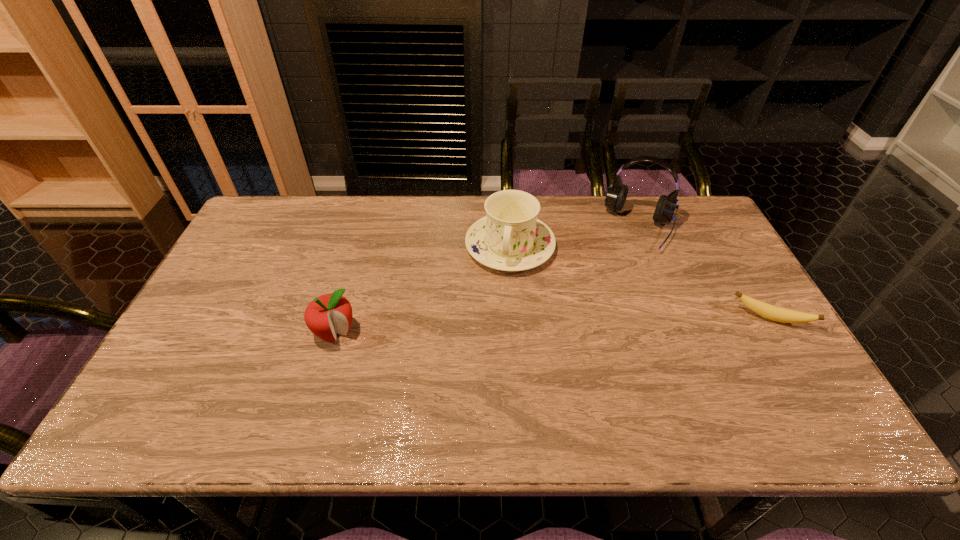
Locate an element on the screen. vacant space at the near edge of the desktop is located at coordinates (725, 390).

The height and width of the screenshot is (540, 960). I want to click on vacant space at the left edge of the desktop, so click(255, 286).

You are a GUI agent. You are given a task and a screenshot of the screen. Output one action in this format:
    pyautogui.click(x=<x>, y=<y>)
    Task: Click on the vacant space at the right edge of the desktop
    The image size is (960, 540).
    Given the screenshot: What is the action you would take?
    pyautogui.click(x=709, y=295)

This screenshot has height=540, width=960. What are the coordinates of `unoccupied position between the third object from right to left and the shortest object` in the screenshot? It's located at (640, 282).

This screenshot has height=540, width=960. Identify the location of empty location between the rightmost object and the chinaware. (640, 282).

You are a GUI agent. You are given a task and a screenshot of the screen. Output one action in this format:
    pyautogui.click(x=<x>, y=<y>)
    Task: Click on the free space between the apple and the third object from left to right
    The height and width of the screenshot is (540, 960).
    Given the screenshot: What is the action you would take?
    pyautogui.click(x=488, y=280)

Identify the location of vacant region between the tallest object and the rightmost object. (706, 273).

Identify the location of vacant area that lies between the leftmost object and the third object from right to left. The height and width of the screenshot is (540, 960). (422, 289).

At what (x,y) coordinates should I click in order to perform the action: click on vacant space that's between the tallest object and the chinaware. Please return your answer as a coordinate pair (x, y). The width and height of the screenshot is (960, 540). Looking at the image, I should click on (575, 237).

Find the location of `vacant space in between the chinaware and the banana`. vacant space in between the chinaware and the banana is located at coordinates (640, 282).